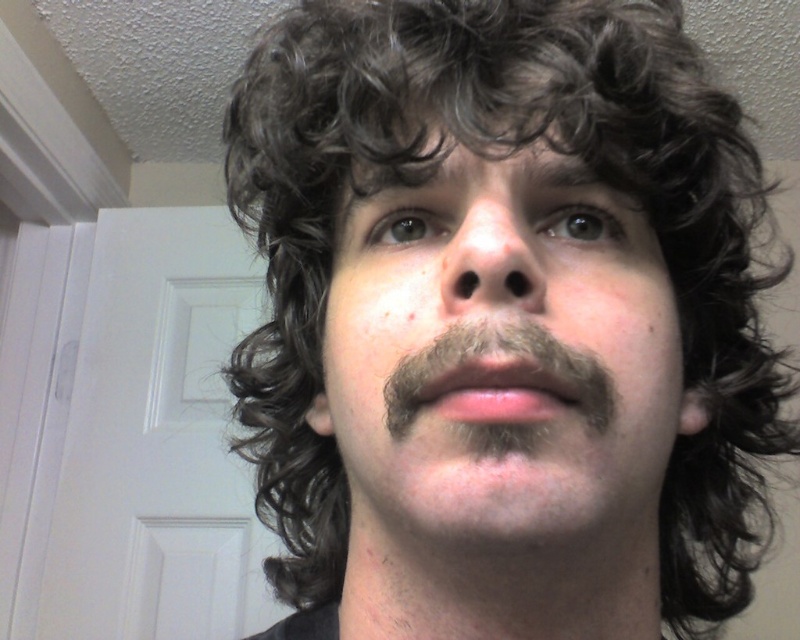
Is dark curly hair at center bigger than dark brown fuzzy mustache at center?

Yes, dark curly hair at center is bigger than dark brown fuzzy mustache at center.

Does dark curly hair at center have a greater width compared to dark brown fuzzy mustache at center?

Indeed, dark curly hair at center has a greater width compared to dark brown fuzzy mustache at center.

At what (x,y) coordinates should I click in order to perform the action: click on dark curly hair at center. Please return your answer as a coordinate pair (x, y). The width and height of the screenshot is (800, 640). Looking at the image, I should click on (500, 355).